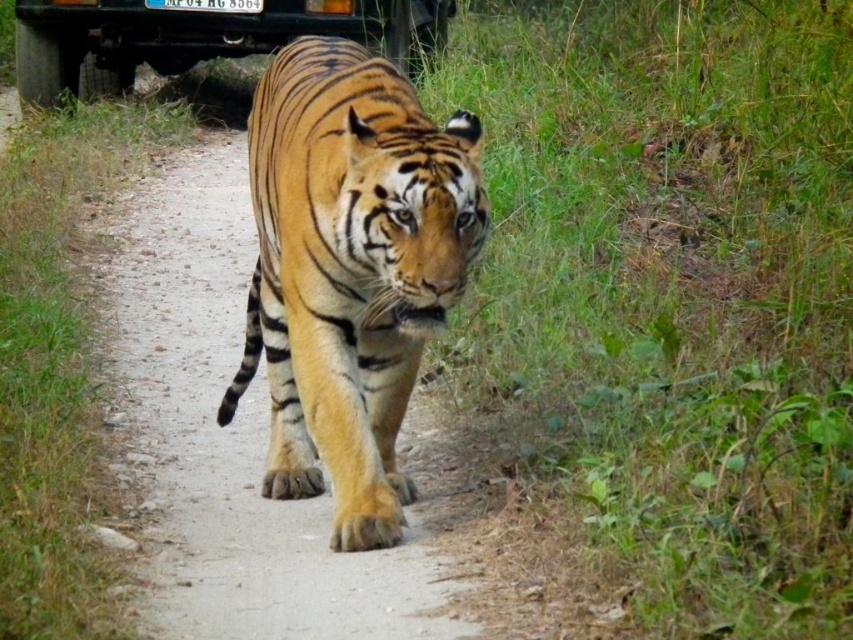
You are a photographer trying to capture the tiger walking along the path. You notice two points in the scene marked as point A and point B. Point A is at coordinate point (340, 451) and point B is at coordinate point (167, 56). Which point is closer to you, the photographer, as you take the photo?

Point A at coordinate point (340, 451) is closer to the photographer than point B at coordinate point (167, 56).